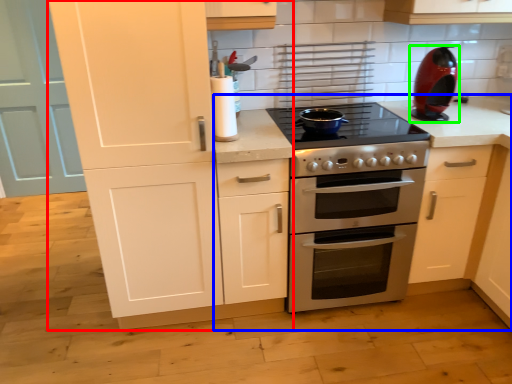
Question: Which object is positioned closest to cabinetry (highlighted by a red box)? Select from countertop (highlighted by a blue box) and kitchen appliance (highlighted by a green box).

Choices:
 (A) countertop
 (B) kitchen appliance

Answer: (A)